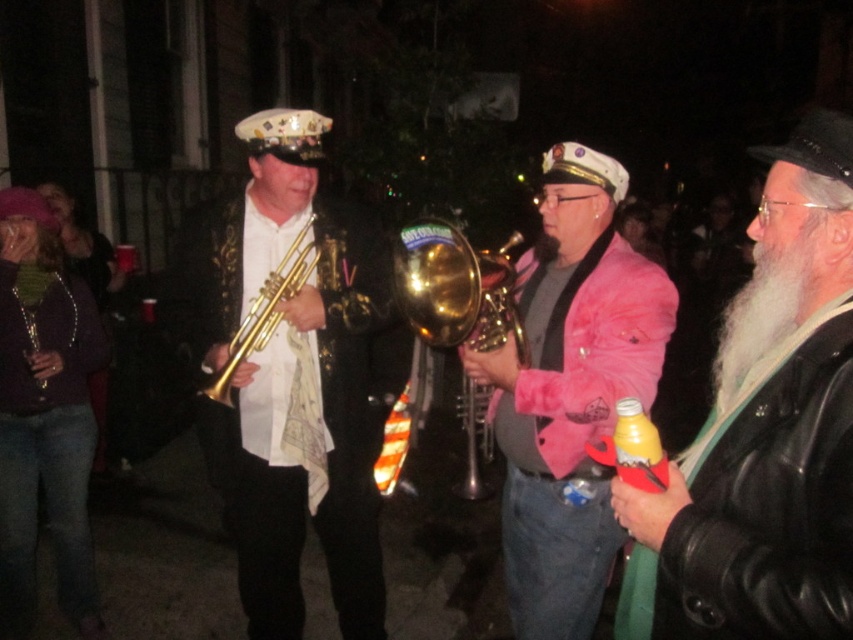
You are a photographer trying to capture a clear photo of the white beard at right and the white fuzzy beard at right. The camera you are using has a focus range of 5 inches. Can you focus on both beards simultaneously?

The white beard at right and white fuzzy beard at right are 6.03 inches apart. Since the camera can only focus within a 5 inch range, they cannot both be in focus at the same time.

Based on the scene description, can you determine the location of the point labeled as point (x=764, y=432)?

The point (x=764, y=432) is located on the white beard at right.

From the picture: You are standing at the center of the scene. There is a point marked at coordinates (764, 432). What object or feature is located at that point?

The point at coordinates (764, 432) marks the white beard at the right.